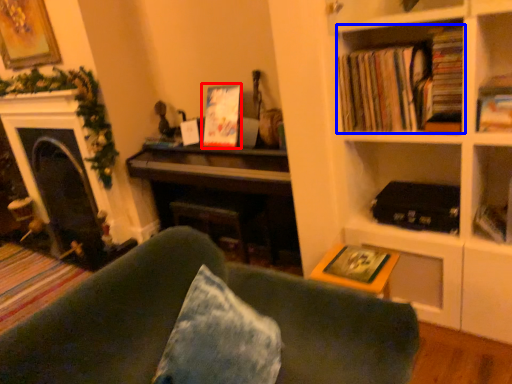
Question: Which of the following is the farthest to the observer, paperback book (highlighted by a red box) or book (highlighted by a blue box)?

Choices:
 (A) paperback book
 (B) book

Answer: (A)